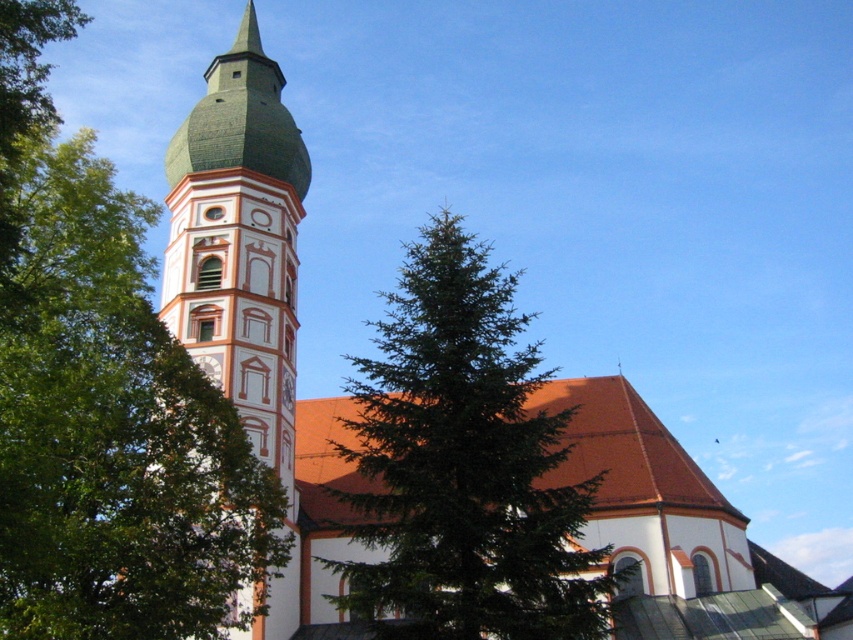
Can you confirm if green textured pine tree at left is shorter than green textured pine tree at center?

Indeed, green textured pine tree at left has a lesser height compared to green textured pine tree at center.

Does green textured pine tree at left come behind green textured pine tree at center?

No, it is not.

What are the coordinates of `green textured pine tree at left` in the screenshot? It's located at (109, 426).

At what (x,y) coordinates should I click in order to perform the action: click on green textured pine tree at left. Please return your answer as a coordinate pair (x, y). Looking at the image, I should click on (109, 426).

Which is more to the left, green textured pine tree at center or green matte steeple at upper left?

From the viewer's perspective, green matte steeple at upper left appears more on the left side.

Is green textured pine tree at center bigger than green matte steeple at upper left?

Yes.

This screenshot has width=853, height=640. What are the coordinates of `green textured pine tree at center` in the screenshot? It's located at (463, 465).

Between green textured pine tree at left and green matte steeple at upper left, which one is positioned lower?

green textured pine tree at left

Who is higher up, green textured pine tree at left or green matte steeple at upper left?

green matte steeple at upper left is higher up.

The height and width of the screenshot is (640, 853). I want to click on green textured pine tree at left, so click(x=109, y=426).

Find the location of a particular element. Image resolution: width=853 pixels, height=640 pixels. green textured pine tree at left is located at coordinates (109, 426).